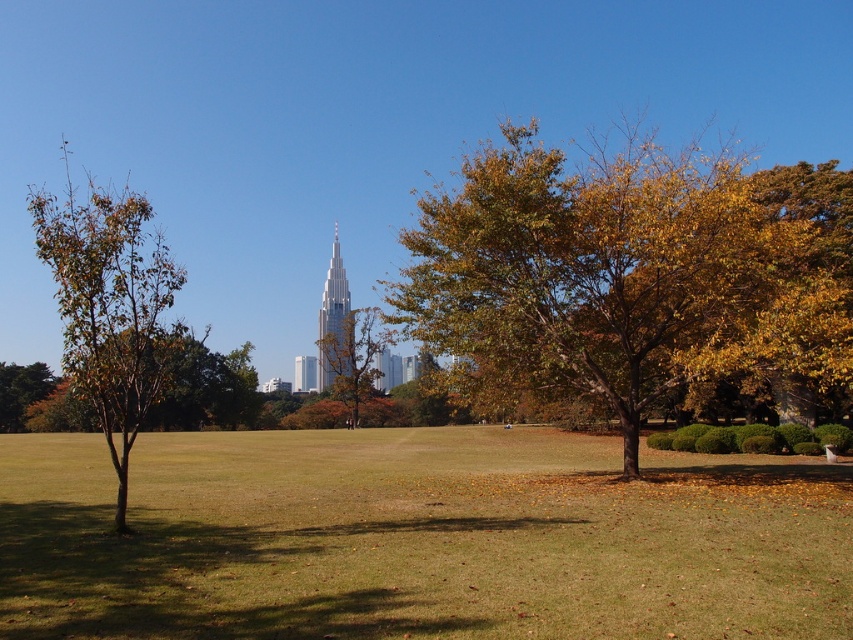
Question: Estimate the real-world distances between objects in this image. Which object is farther from the brown matte tree at left?

Choices:
 (A) autumn leaves tree at center
 (B) brown leafy tree at left
 (C) shiny glass skyscraper at center
 (D) yellow-green foliage at center

Answer: (D)

Question: Does brown matte tree at left appear on the right side of shiny glass skyscraper at center?

Choices:
 (A) no
 (B) yes

Answer: (A)

Question: Which object is positioned closest to the autumn leaves tree at center?

Choices:
 (A) shiny glass skyscraper at center
 (B) brown leafy tree at left

Answer: (A)

Question: Among these points, which one is nearest to the camera?

Choices:
 (A) (4, 406)
 (B) (257, 584)
 (C) (329, 332)

Answer: (B)

Question: Is yellow-green foliage at center above brown leafy tree at left?

Choices:
 (A) yes
 (B) no

Answer: (A)

Question: Does green grass at center have a greater width compared to yellow-green foliage at center?

Choices:
 (A) no
 (B) yes

Answer: (A)